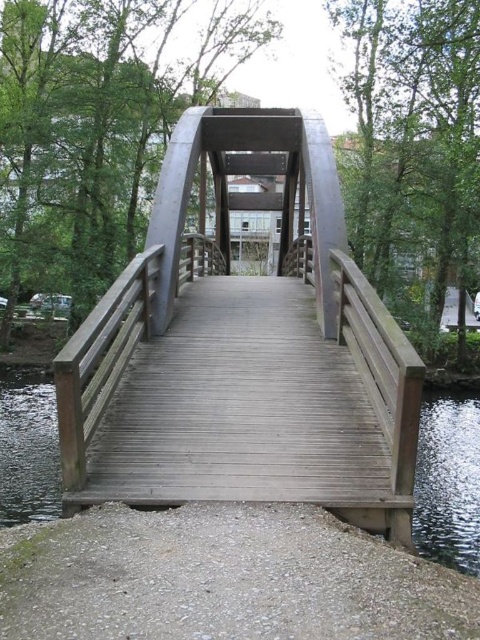
You are standing at the point marked by the coordinates point (243, 349). What object are you directly on?

The point (243, 349) indicates wooden bridge at center, so you are directly on the wooden bridge at center.

Based on the photo, you are standing on the wooden bridge at center and want to walk to the smooth gravel path at lower center. Which direction should you face to walk towards it?

You should face away from the wooden bridge at center towards the smooth gravel path at lower center since the path is behind the bridge.

You are a hiker carrying a heavy backpack and need to cross the bridge. The smooth gravel path at lower center and the clear water at bridge center are both visible from your position. Which path would you choose to ensure a more stable footing?

The smooth gravel path at lower center is shorter than the clear water at bridge center, so choosing the smooth gravel path at lower center would provide a more stable footing since it is a solid surface compared to the water.